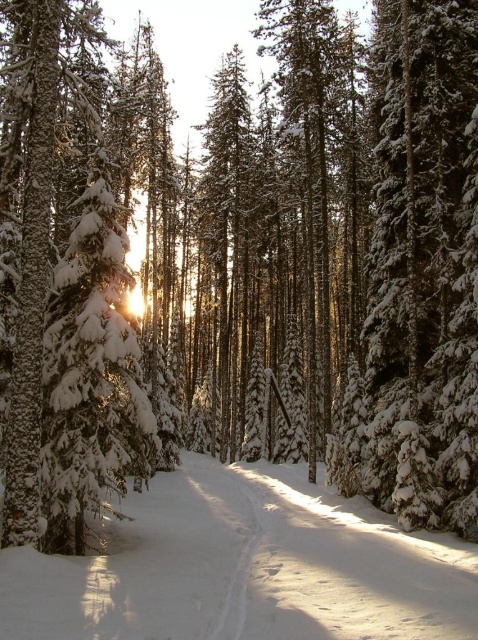
Who is positioned more to the left, white snow path at center or white snow-covered tree at left?

Positioned to the left is white snow-covered tree at left.

Where is `white snow path at center`? white snow path at center is located at coordinates (245, 566).

Who is taller, white snow path at center or snow-covered evergreen tree at right?

Standing taller between the two is snow-covered evergreen tree at right.

Which is behind, point (183, 528) or point (399, 90)?

Positioned behind is point (399, 90).

Image resolution: width=478 pixels, height=640 pixels. Find the location of `white snow path at center`. white snow path at center is located at coordinates (245, 566).

Does snow-covered evergreen tree at right have a lesser width compared to white snow-covered tree at left?

Indeed, snow-covered evergreen tree at right has a lesser width compared to white snow-covered tree at left.

Which is below, snow-covered evergreen tree at right or white snow-covered tree at left?

snow-covered evergreen tree at right

Which is behind, point (365, 468) or point (97, 276)?

Point (365, 468)

I want to click on snow-covered evergreen tree at right, so click(x=423, y=264).